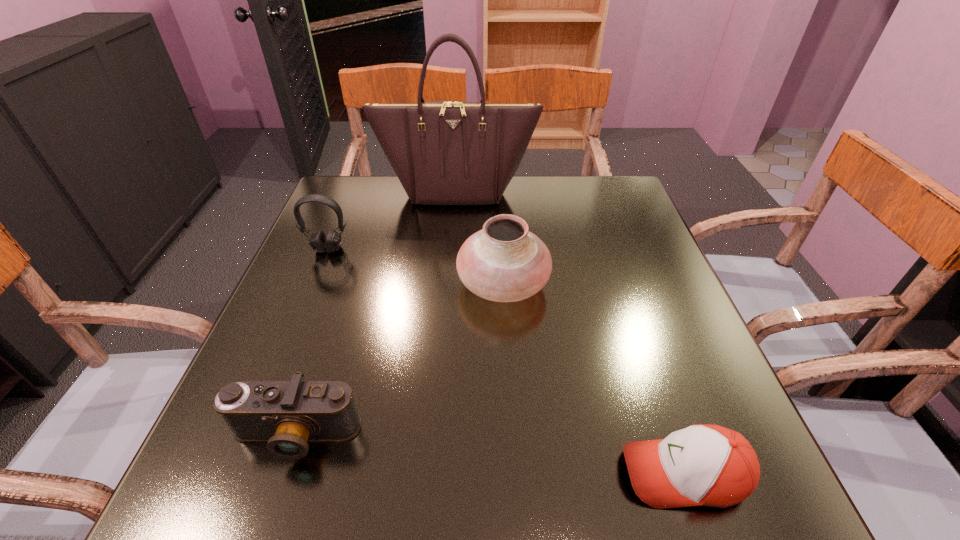
Locate an element on the screen. The width and height of the screenshot is (960, 540). free spot located on the front-facing side of the baseball cap is located at coordinates (561, 474).

The width and height of the screenshot is (960, 540). Identify the location of vacant space situated on the front-facing side of the baseball cap. (479, 474).

Identify the location of object that is at the far edge. This screenshot has height=540, width=960. (448, 152).

Where is `camera located in the near edge section of the desktop`? This screenshot has height=540, width=960. camera located in the near edge section of the desktop is located at coordinates (287, 414).

Where is `baseball cap located in the near edge section of the desktop`? baseball cap located in the near edge section of the desktop is located at coordinates point(702,465).

At what (x,y) coordinates should I click in order to perform the action: click on handbag present at the left edge. Please return your answer as a coordinate pair (x, y). Image resolution: width=960 pixels, height=540 pixels. Looking at the image, I should click on (448, 152).

The height and width of the screenshot is (540, 960). In order to click on headset that is at the left edge in this screenshot , I will do `click(319, 242)`.

Locate an element on the screen. The image size is (960, 540). camera located at the left edge is located at coordinates click(x=287, y=414).

I want to click on object that is at the right edge, so click(x=702, y=465).

Locate an element on the screen. The image size is (960, 540). object at the far left corner is located at coordinates (x=448, y=152).